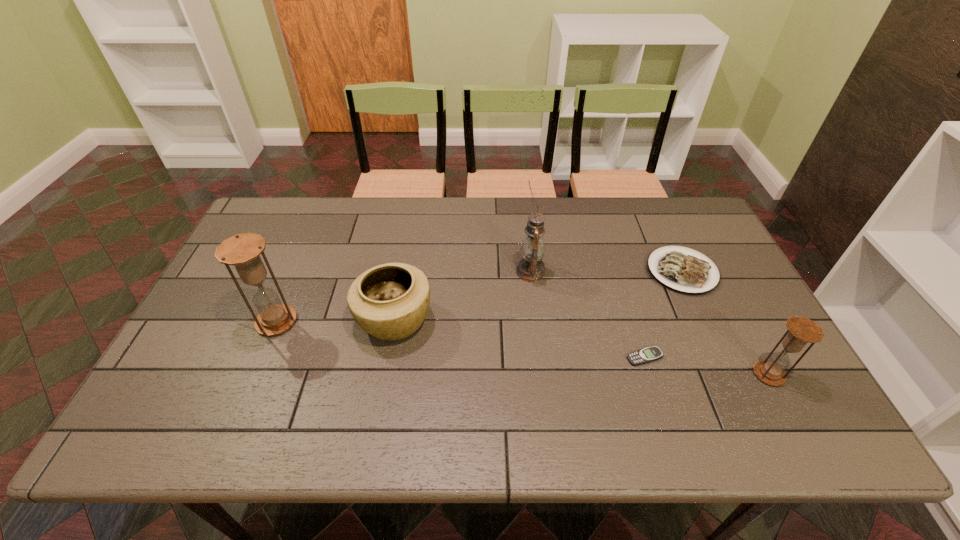
The height and width of the screenshot is (540, 960). Identify the location of the shortest object. (646, 355).

Find the location of a particular element. The width and height of the screenshot is (960, 540). free region located on the left of the leftmost object is located at coordinates [234, 321].

At what (x,y) coordinates should I click in order to perform the action: click on free location located 0.340m on the back of the right hourglass. Please return your answer as a coordinate pair (x, y). Looking at the image, I should click on (711, 267).

Find the location of a particular element. This screenshot has height=540, width=960. vacant space located 0.160m on the left of the second shortest object is located at coordinates (589, 271).

What are the coordinates of `blank space located 0.090m on the back of the fourth object from right to left` in the screenshot? It's located at (527, 240).

The height and width of the screenshot is (540, 960). Find the location of `free space located on the back of the fifth object from right to left`. free space located on the back of the fifth object from right to left is located at coordinates (407, 248).

Identify the location of free spot located on the right of the beeper. The height and width of the screenshot is (540, 960). (751, 357).

Find the location of a particular element. This screenshot has width=960, height=540. object that is at the near edge is located at coordinates (802, 330).

At what (x,y) coordinates should I click in order to perform the action: click on object that is at the left edge. Please return your answer as a coordinate pair (x, y). This screenshot has height=540, width=960. Looking at the image, I should click on (243, 251).

This screenshot has height=540, width=960. Identify the location of hourglass positioned at the right edge. (802, 330).